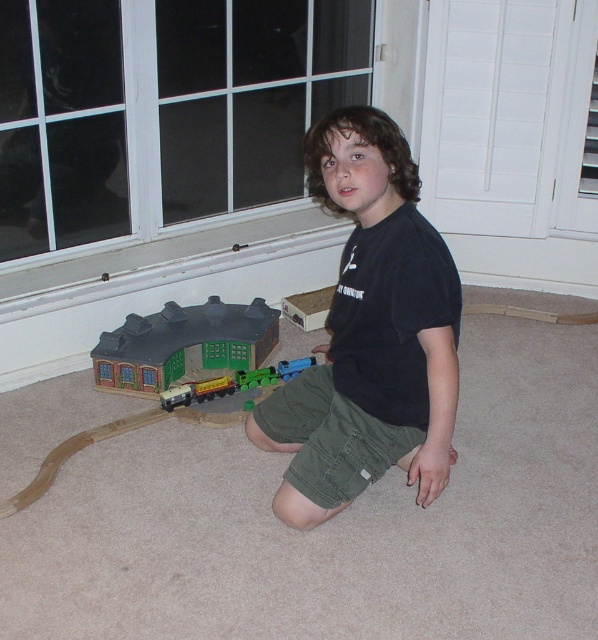
Is point (150, 378) closer to viewer compared to point (309, 356)?

Yes, point (150, 378) is closer to viewer.

Who is more distant from viewer, (178, 376) or (291, 362)?

The point (178, 376) is behind.

At what (x,y) coordinates should I click in order to perform the action: click on green plastic train station at lower left. Please return your answer as a coordinate pair (x, y). Looking at the image, I should click on (182, 342).

Locate an element on the screen. This screenshot has width=598, height=640. black cotton shirt at center is located at coordinates (373, 324).

Does black cotton shirt at center have a lesser height compared to white wood screen door at upper right?

No, black cotton shirt at center is not shorter than white wood screen door at upper right.

Does point (350, 179) come in front of point (483, 157)?

That is True.

You are a GUI agent. You are given a task and a screenshot of the screen. Output one action in this format:
    pyautogui.click(x=<x>, y=<y>)
    Task: Click on the black cotton shirt at center
    The width and height of the screenshot is (598, 640).
    Given the screenshot: What is the action you would take?
    pyautogui.click(x=373, y=324)

Does point (160, 348) come in front of point (206, 362)?

Yes, it is in front of point (206, 362).

Which of these two, brick-textured train station at lower left or green plastic train station at lower left, stands taller?

Standing taller between the two is brick-textured train station at lower left.

Describe the element at coordinates (169, 376) in the screenshot. The height and width of the screenshot is (640, 598). I see `brick-textured train station at lower left` at that location.

The width and height of the screenshot is (598, 640). I want to click on brick-textured train station at lower left, so click(x=169, y=376).